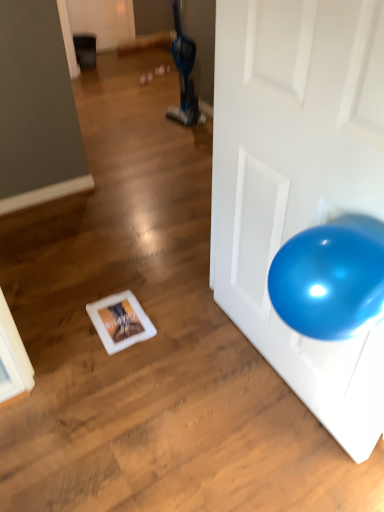
I want to click on vacant space in front of glossy white door at right, so click(264, 446).